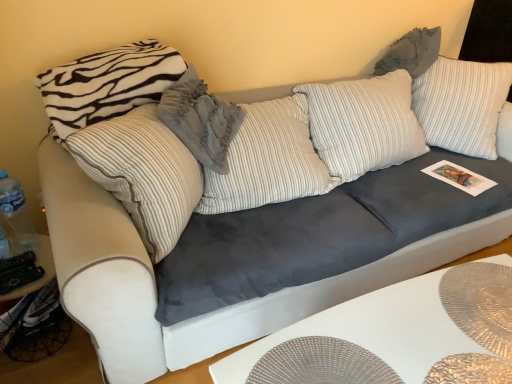
Question: From the image's perspective, is velvety gray pillow at center, placed as the second pillow when sorted from right to left, above or below gray textured pillow at upper right, which is counted as the third pillow, starting from the left?

Choices:
 (A) above
 (B) below

Answer: (B)

Question: From a real-world perspective, is velvety gray pillow at center, placed as the second pillow when sorted from right to left, positioned above or below gray textured pillow at upper right, placed as the 1th pillow when sorted from right to left?

Choices:
 (A) below
 (B) above

Answer: (A)

Question: Which object is positioned farthest from the gray textured pillow at upper right, placed as the 1th pillow when sorted from right to left?

Choices:
 (A) white striped pillow at upper left, positioned as the 3th pillow in right-to-left order
 (B) white textured placemat at lower right
 (C) velvety gray pillow at center, marked as the 2th pillow in a left-to-right arrangement

Answer: (B)

Question: Estimate the real-world distances between objects in this image. Which object is closer to the white striped pillow at upper left, positioned as the 3th pillow in right-to-left order?

Choices:
 (A) gray textured pillow at upper right, which is counted as the third pillow, starting from the left
 (B) velvety gray pillow at center, marked as the 2th pillow in a left-to-right arrangement
 (C) white textured placemat at lower right

Answer: (B)